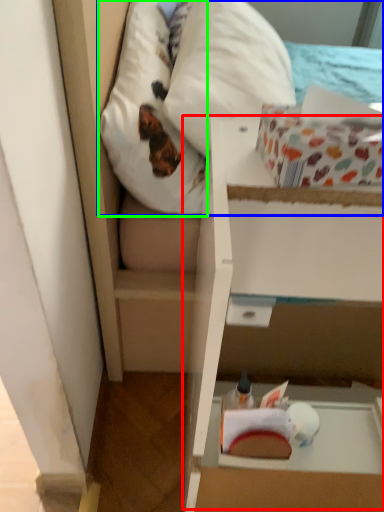
Question: Which object is the farthest from cardboard box (highlighted by a red box)? Choose among these: mattress (highlighted by a blue box) or pillow (highlighted by a green box).

Choices:
 (A) mattress
 (B) pillow

Answer: (A)